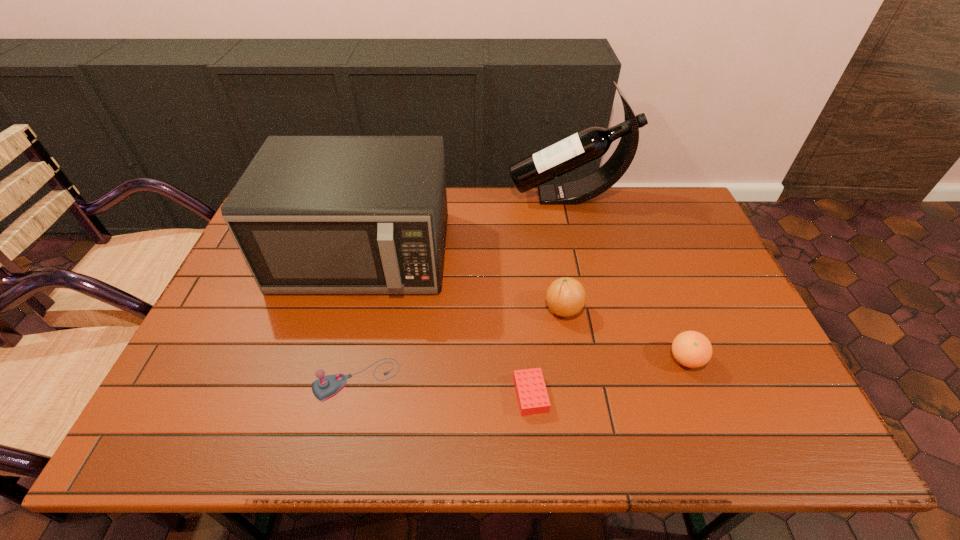
What are the coordinates of `the farthest object` in the screenshot? It's located at (579, 149).

Identify the location of the tallest object. The image size is (960, 540). (579, 149).

At what (x,y) coordinates should I click in order to perform the action: click on the second tallest object. Please return your answer as a coordinate pair (x, y). The image size is (960, 540). Looking at the image, I should click on (311, 214).

Find the location of `the farther orange`. the farther orange is located at coordinates (565, 296).

Locate an element on the screen. This screenshot has height=540, width=960. the fourth shortest object is located at coordinates (565, 296).

At what (x,y) coordinates should I click in order to perform the action: click on the right orange. Please return your answer as a coordinate pair (x, y). Looking at the image, I should click on (692, 349).

Locate an element on the screen. The height and width of the screenshot is (540, 960). the shorter orange is located at coordinates (692, 349).

This screenshot has width=960, height=540. Identify the location of joystick. (325, 387).

The image size is (960, 540). What are the coordinates of `the shortest object` in the screenshot? It's located at (532, 396).

Locate an element on the screen. The width and height of the screenshot is (960, 540). vacant space located 0.380m on the stand of the tallest object is located at coordinates click(x=400, y=197).